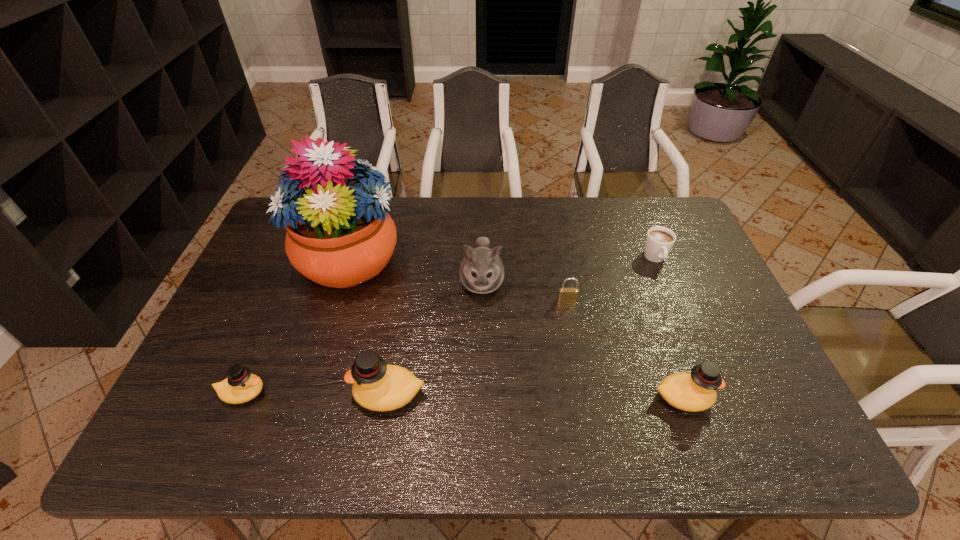
The height and width of the screenshot is (540, 960). Identify the location of free space between the flower arrangement and the leftmost duck. (297, 327).

Find the location of `vacant area that lies between the flower arrangement and the third object from right to left`. vacant area that lies between the flower arrangement and the third object from right to left is located at coordinates (459, 280).

The width and height of the screenshot is (960, 540). What are the coordinates of `free space between the shortest duck and the fourth object from right to left` in the screenshot? It's located at point(362,338).

In order to click on free point between the fourth object from right to left and the leftmost duck in this screenshot , I will do coord(362,338).

Locate an element on the screen. The width and height of the screenshot is (960, 540). free space between the cappuccino and the padlock is located at coordinates (612, 280).

Identify the location of free space that is in between the leftmost duck and the padlock. Image resolution: width=960 pixels, height=540 pixels. (405, 347).

Identify the location of free space that is in between the hamster and the tallest object. (417, 272).

This screenshot has width=960, height=540. What are the coordinates of `vacant space in between the hamster and the padlock` in the screenshot? It's located at (524, 292).

This screenshot has height=540, width=960. I want to click on free space that is in between the cappuccino and the tallest duck, so click(522, 326).

Where is `vacant space that is in between the tallest object and the rightmost duck`? This screenshot has height=540, width=960. vacant space that is in between the tallest object and the rightmost duck is located at coordinates (517, 329).